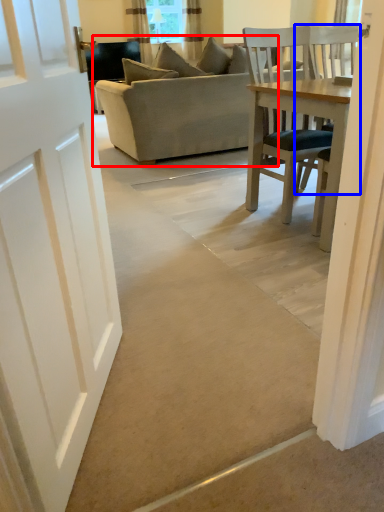
Question: Which of the following is the closest to the observer, studio couch (highlighted by a red box) or chair (highlighted by a blue box)?

Choices:
 (A) studio couch
 (B) chair

Answer: (B)